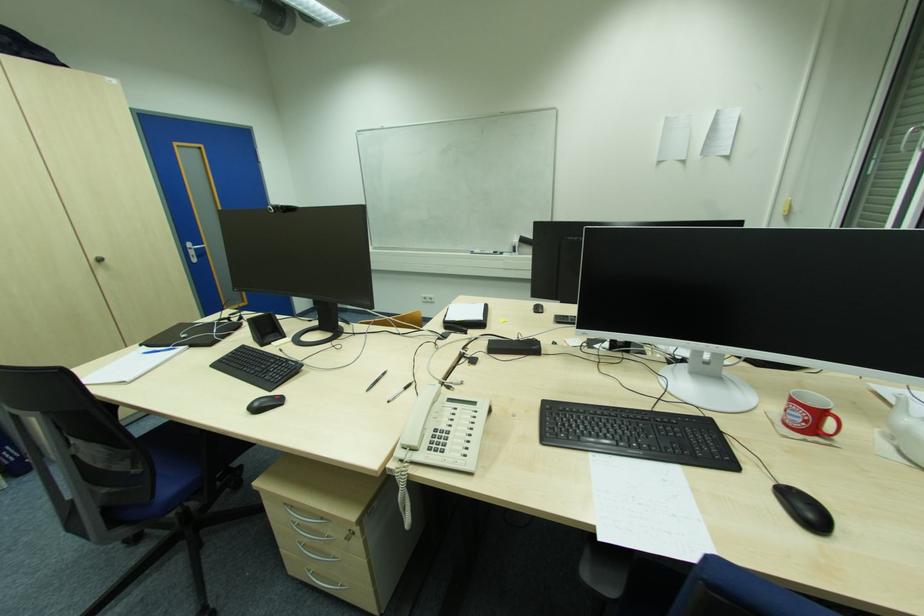
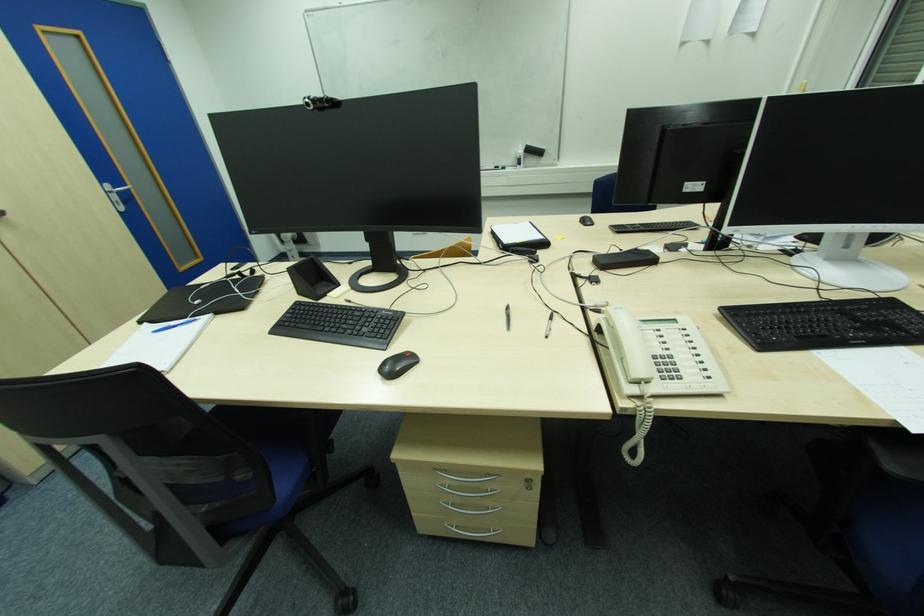
In the second image, find the point that corresponds to the point at 457,410 in the first image.

(661, 331)